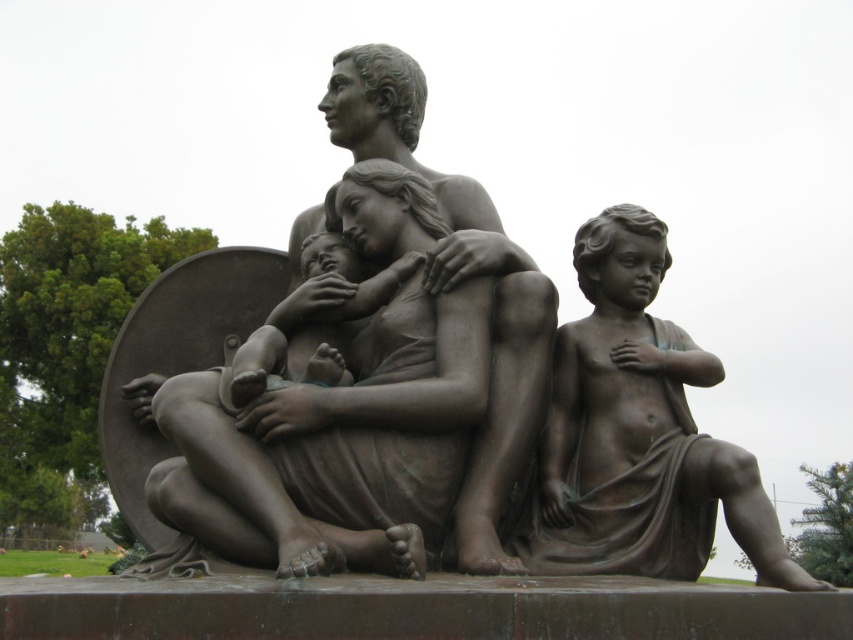
Question: Can you confirm if bronze sculpture at center is bigger than bronze statue of child at right?

Choices:
 (A) yes
 (B) no

Answer: (A)

Question: Which point is farther from the camera taking this photo?

Choices:
 (A) (633, 380)
 (B) (521, 468)

Answer: (B)

Question: Is bronze sculpture at center wider than bronze statue of child at right?

Choices:
 (A) no
 (B) yes

Answer: (B)

Question: Can you confirm if bronze sculpture at center is positioned below bronze statue of child at right?

Choices:
 (A) yes
 (B) no

Answer: (B)